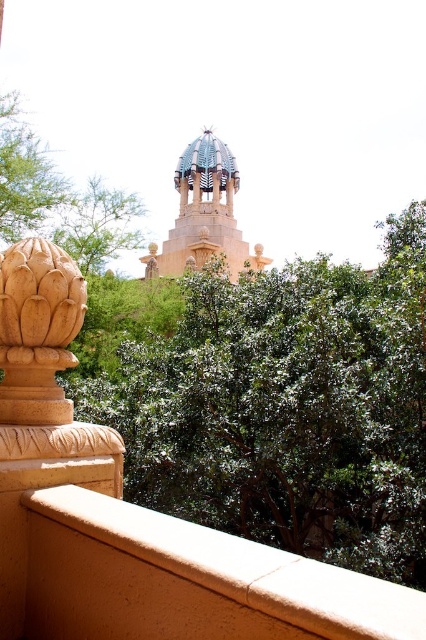
You are an artist sketching the scene from the balcony. You need to decide where to place your easel so both the smooth beige ledge at lower left and the green leafy tree at upper left are visible in your drawing. Which object should you position closer to the edge of your paper to maintain their relative sizes?

Since the smooth beige ledge at lower left occupies less space than the green leafy tree at upper left, you should position the smooth beige ledge at lower left closer to the edge of your paper. This will help maintain their relative sizes as seen in the scene.

You are standing on the balcony and looking at the green leafy tree at center and the golden stone finial at left. Which object is closer to you?

The green leafy tree at center is closer to you because it is further to the viewer than the golden stone finial at left.

You are standing on the balcony looking at the historic building. You see the green leafy tree at center and the golden stone finial at left. Which object is positioned to the right of the other?

The green leafy tree at center is positioned to the right of the golden stone finial at left.